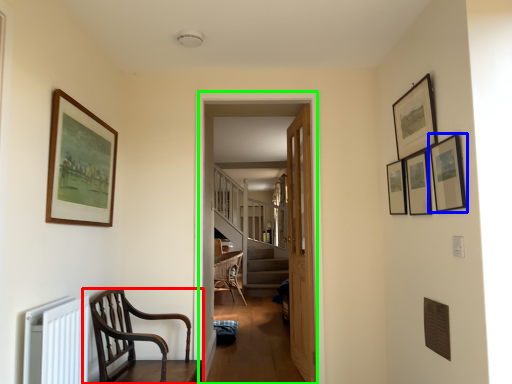
Question: Based on their relative distances, which object is farther from chair (highlighted by a red box)? Choose from picture frame (highlighted by a blue box) and corridor (highlighted by a green box).

Choices:
 (A) picture frame
 (B) corridor

Answer: (A)